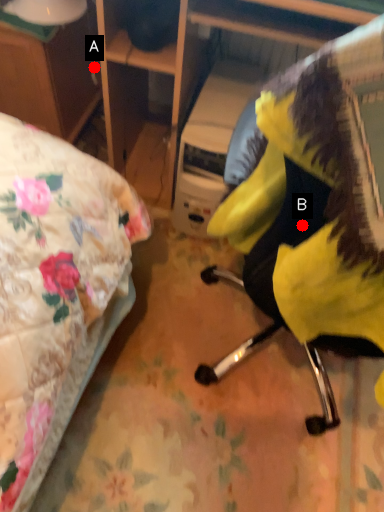
Question: Two points are circled on the image, labeled by A and B beside each circle. Which of the following is the farthest from the observer?

Choices:
 (A) A is further
 (B) B is further

Answer: (A)